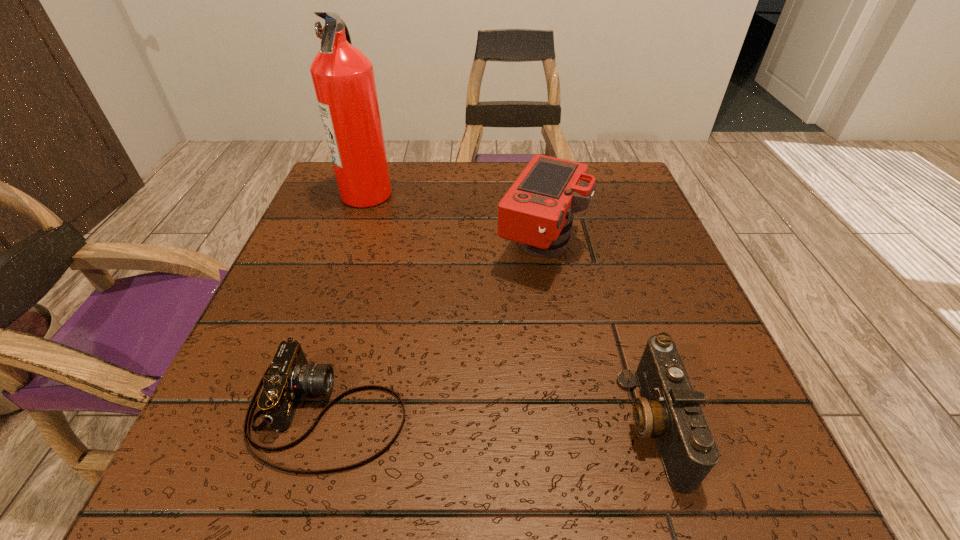
Find the location of a particular element. The width and height of the screenshot is (960, 540). object located at the near right corner is located at coordinates click(669, 409).

Where is `vacant space at the far edge of the desktop`? The width and height of the screenshot is (960, 540). vacant space at the far edge of the desktop is located at coordinates (419, 161).

This screenshot has height=540, width=960. What are the coordinates of `free region at the left edge of the desktop` in the screenshot? It's located at (309, 337).

In order to click on vacant space at the right edge of the desktop in this screenshot , I will do point(607,226).

The width and height of the screenshot is (960, 540). What are the coordinates of `vacant region at the far right corner of the desktop` in the screenshot? It's located at (601, 161).

At what (x,y) coordinates should I click in order to perform the action: click on vacant space that is in between the shortest object and the tallest object. Please return your answer as a coordinate pair (x, y). Looking at the image, I should click on (348, 302).

Locate an element on the screen. This screenshot has width=960, height=540. free space between the second shortest object and the second tallest object is located at coordinates (597, 335).

Where is `vacant space that is in between the second tallest object and the tallest object`? This screenshot has width=960, height=540. vacant space that is in between the second tallest object and the tallest object is located at coordinates (454, 220).

Locate an element on the screen. Image resolution: width=960 pixels, height=540 pixels. free space between the third nearest object and the second shortest object is located at coordinates (597, 335).

Identify the location of empty space between the farthest camera and the third tallest object. (597, 335).